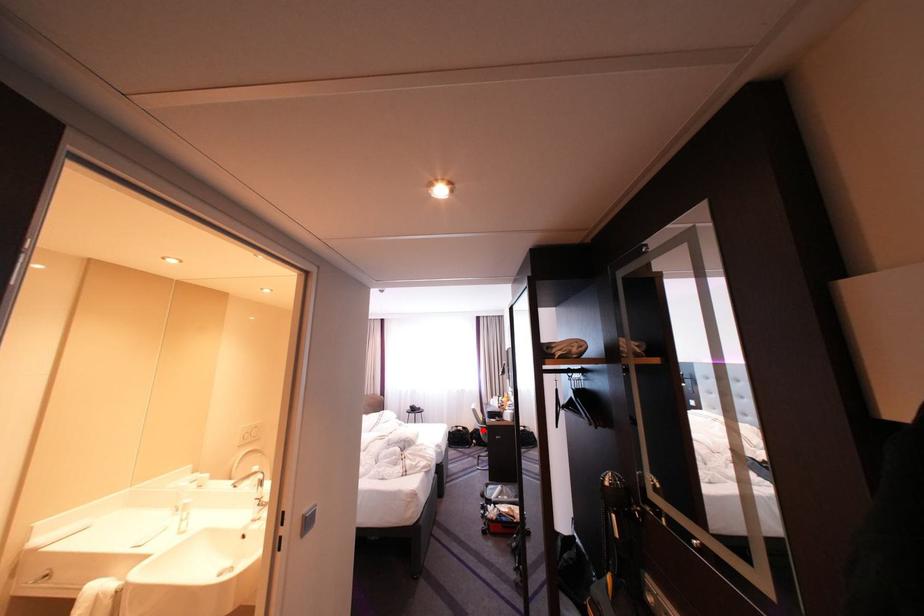
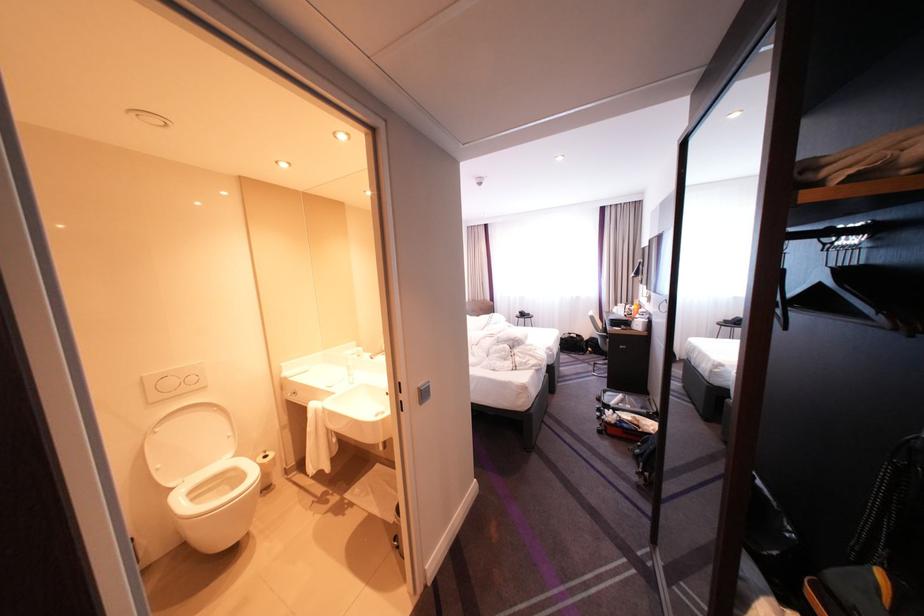
Find the pixel in the second image that matches the highlighted location in the first image.

(599, 338)